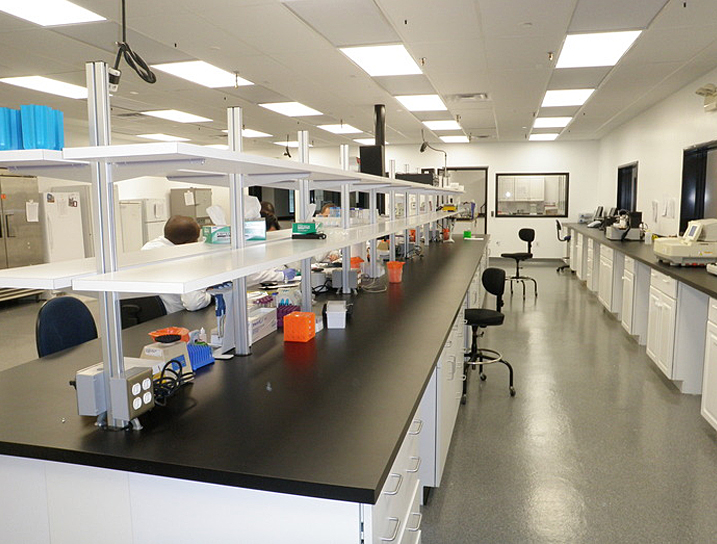
Identify the location of place to sit. This screenshot has height=544, width=717. (483, 321), (518, 252), (564, 232), (60, 321).